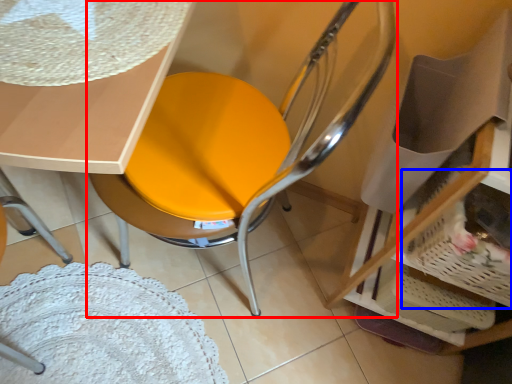
Question: Which object appears closest to the camera in this image, chair (highlighted by a red box) or basket (highlighted by a blue box)?

Choices:
 (A) chair
 (B) basket

Answer: (A)